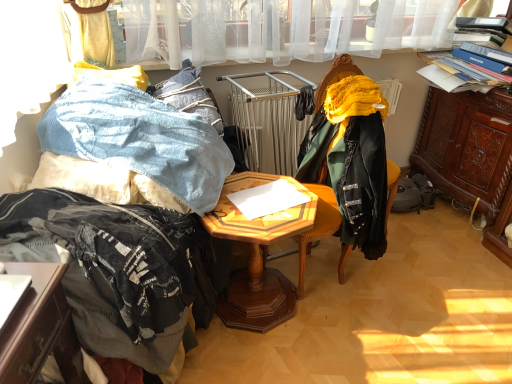
Question: Is velvet green chair at center at the left side of woodenobject at center?

Choices:
 (A) no
 (B) yes

Answer: (A)

Question: Could you tell me if velvet green chair at center is turned towards woodenobject at center?

Choices:
 (A) yes
 (B) no

Answer: (A)

Question: Considering the relative sizes of velvet green chair at center and woodenobject at center in the image provided, is velvet green chair at center wider than woodenobject at center?

Choices:
 (A) no
 (B) yes

Answer: (A)

Question: Can you confirm if velvet green chair at center is positioned to the right of woodenobject at center?

Choices:
 (A) yes
 (B) no

Answer: (A)

Question: Is velvet green chair at center far from woodenobject at center?

Choices:
 (A) no
 (B) yes

Answer: (A)

Question: Considering the positions of point (104, 125) and point (458, 157), is point (104, 125) closer or farther from the camera than point (458, 157)?

Choices:
 (A) farther
 (B) closer

Answer: (B)

Question: In the image, is denim fabric at left on the left side or the right side of brown carved wood cabinet at right?

Choices:
 (A) right
 (B) left

Answer: (B)

Question: Considering the positions of denim fabric at left and brown carved wood cabinet at right in the image, is denim fabric at left taller or shorter than brown carved wood cabinet at right?

Choices:
 (A) tall
 (B) short

Answer: (B)

Question: Choose the correct answer: Is denim fabric at left inside brown carved wood cabinet at right or outside it?

Choices:
 (A) outside
 (B) inside

Answer: (A)

Question: Is point (232, 273) closer or farther from the camera than point (150, 122)?

Choices:
 (A) farther
 (B) closer

Answer: (A)

Question: Is woodenobject at center wider or thinner than denim fabric at left?

Choices:
 (A) wide
 (B) thin

Answer: (B)

Question: From the image's perspective, is woodenobject at center positioned above or below denim fabric at left?

Choices:
 (A) above
 (B) below

Answer: (B)

Question: From a real-world perspective, relative to denim fabric at left, is woodenobject at center vertically above or below?

Choices:
 (A) below
 (B) above

Answer: (A)

Question: In the image, is fuzzy black blanket at left on the left side or the right side of velvet green chair at center?

Choices:
 (A) left
 (B) right

Answer: (A)

Question: In terms of width, does fuzzy black blanket at left look wider or thinner when compared to velvet green chair at center?

Choices:
 (A) thin
 (B) wide

Answer: (B)